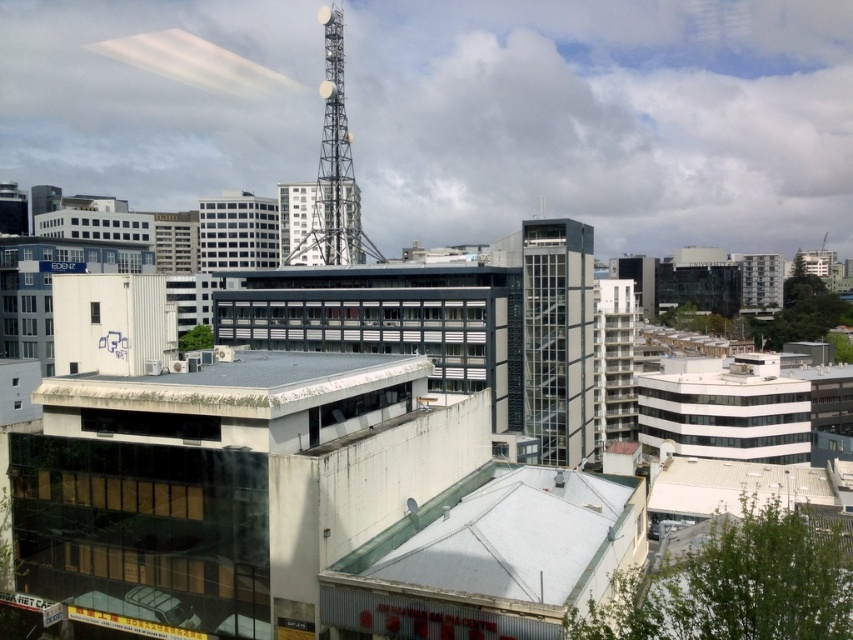
Locate an element on the screen. The width and height of the screenshot is (853, 640). white weathered roof at lower left is located at coordinates (239, 385).

Does glassy steel building at center appear on the right side of metallic tower at upper center?

Correct, you'll find glassy steel building at center to the right of metallic tower at upper center.

Does glassy steel building at center have a larger size compared to metallic tower at upper center?

Actually, glassy steel building at center might be smaller than metallic tower at upper center.

At what (x,y) coordinates should I click in order to perform the action: click on glassy steel building at center. Please return your answer as a coordinate pair (x, y). Looking at the image, I should click on (550, 336).

Looking at this image, who is taller, glassy steel building at center or white weathered roof at lower left?

With more height is glassy steel building at center.

Which is more to the left, glassy steel building at center or white weathered roof at lower left?

white weathered roof at lower left

I want to click on glassy steel building at center, so click(550, 336).